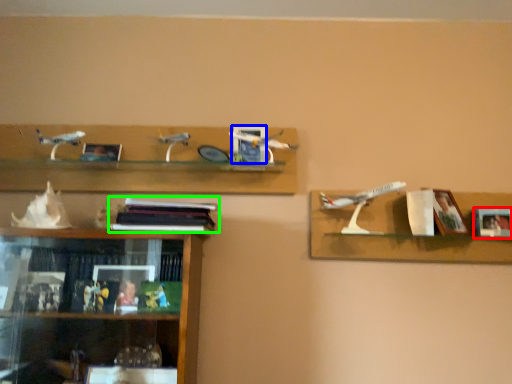
Question: Which object is the closest to the picture frame (highlighted by a red box)? Choose among these: picture frame (highlighted by a blue box) or book (highlighted by a green box).

Choices:
 (A) picture frame
 (B) book

Answer: (A)